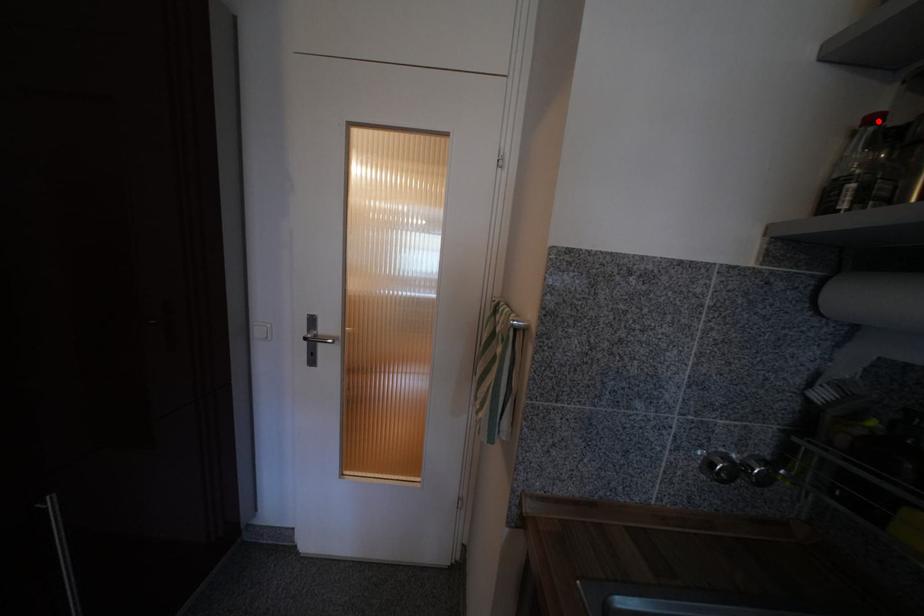
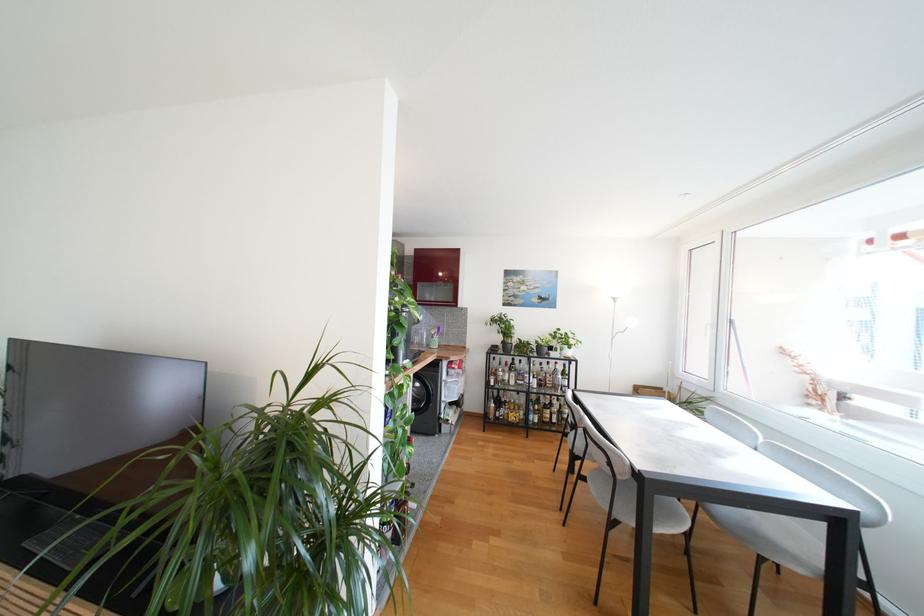
Question: I am providing you with two images of the same scene from different viewpoints. A red point is marked on the first image. Can you still see the location of the red point in image 2?

Choices:
 (A) Yes
 (B) No

Answer: (B)